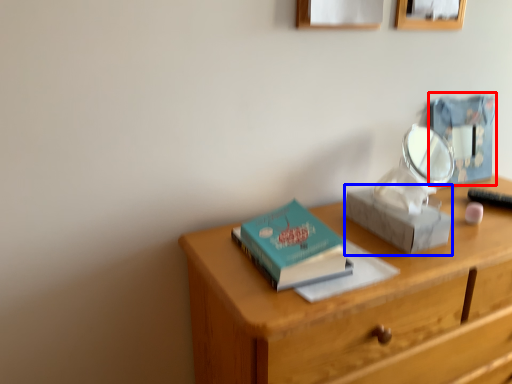
Question: Which point is closer to the camera, box (highlighted by a red box) or shoe box (highlighted by a blue box)?

Choices:
 (A) box
 (B) shoe box

Answer: (B)